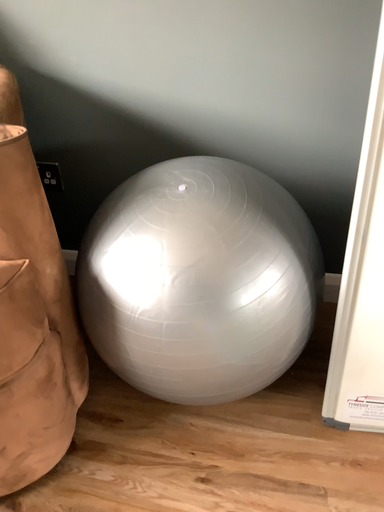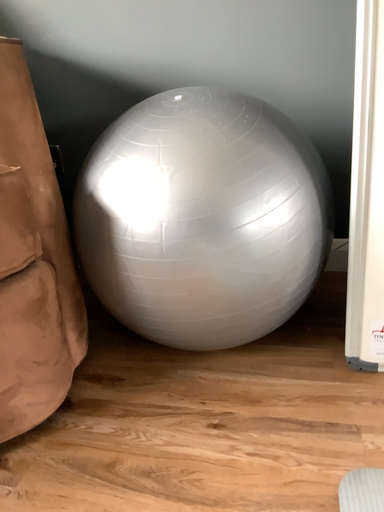
Question: How did the camera likely rotate when shooting the video?

Choices:
 (A) rotated downward
 (B) rotated upward

Answer: (B)